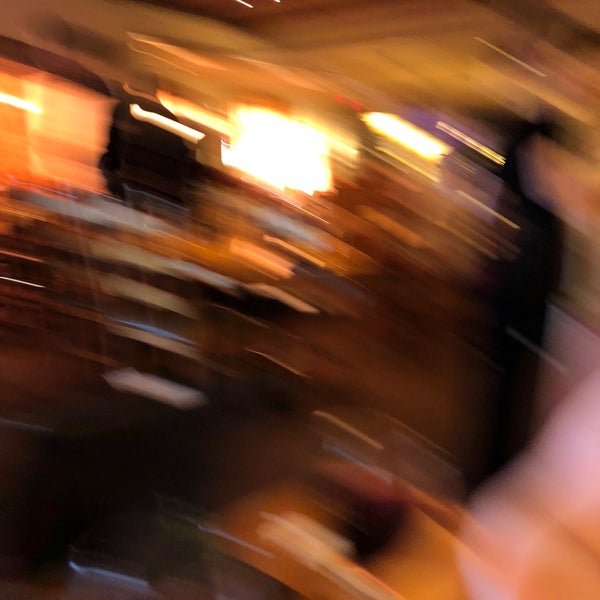
You are a GUI agent. You are given a task and a screenshot of the screen. Output one action in this format:
    pyautogui.click(x=<x>, y=<y>)
    Task: Click on the bright yellow light
    This screenshot has height=600, width=600.
    Given the screenshot: What is the action you would take?
    pyautogui.click(x=305, y=147)